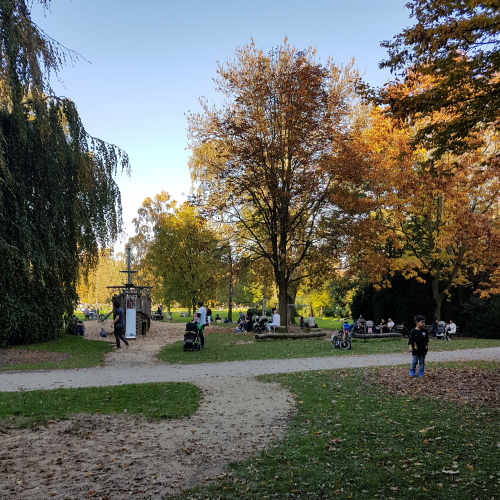
You are a GUI agent. You are given a task and a screenshot of the screen. Output one action in this format:
    pyautogui.click(x=<x>, y=<y>)
    Task: Click on the model ship
    This screenshot has width=500, height=500.
    Given the screenshot: What is the action you would take?
    pyautogui.click(x=144, y=302)